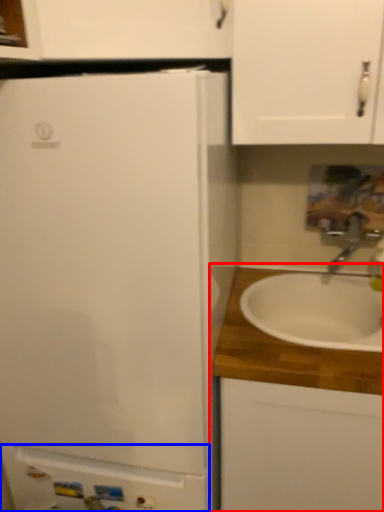
Question: Among these objects, which one is nearest to the camera, cabinetry (highlighted by a red box) or cabinetry (highlighted by a blue box)?

Choices:
 (A) cabinetry
 (B) cabinetry

Answer: (A)